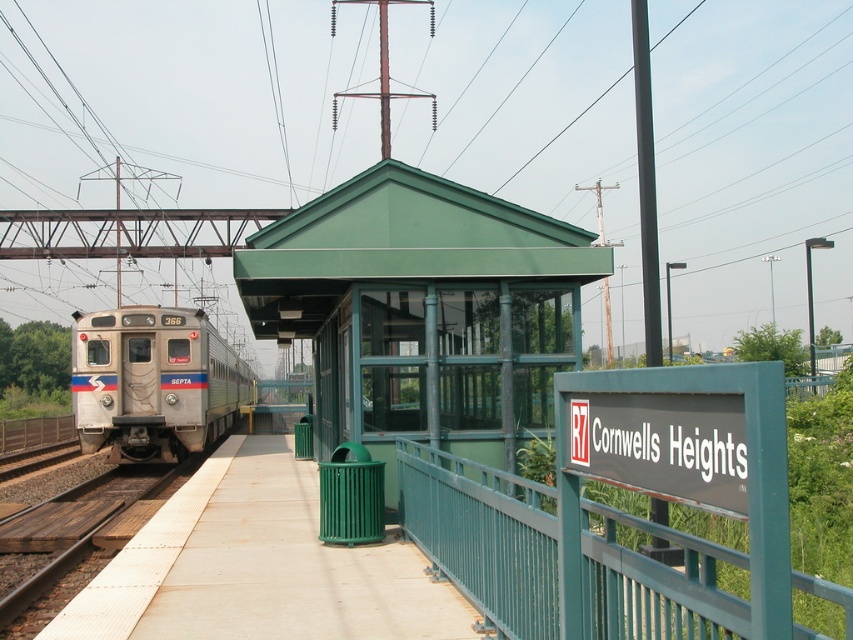
Question: Which point is closer to the camera?

Choices:
 (A) silver metallic train at left
 (B) smooth concrete platform at center

Answer: (B)

Question: Can you confirm if smooth concrete platform at center is positioned to the right of silver metallic train at left?

Choices:
 (A) no
 (B) yes

Answer: (B)

Question: Which of the following is the closest to the observer?

Choices:
 (A) smooth concrete platform at center
 (B) silver metallic train at left

Answer: (A)

Question: Is smooth concrete platform at center closer to camera compared to silver metallic train at left?

Choices:
 (A) yes
 (B) no

Answer: (A)

Question: Which point is closer to the camera?

Choices:
 (A) (177, 310)
 (B) (428, 579)

Answer: (B)

Question: Observing the image, what is the correct spatial positioning of smooth concrete platform at center in reference to silver metallic train at left?

Choices:
 (A) below
 (B) above

Answer: (A)